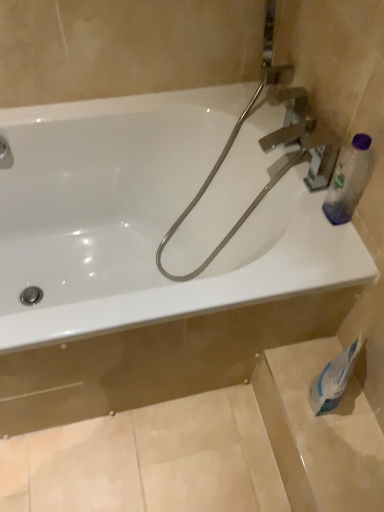
Question: From a real-world perspective, relative to transparent plastic bottle at upper right, is matte silver faucet at upper left vertically above or below?

Choices:
 (A) above
 (B) below

Answer: (B)

Question: Looking at their shapes, would you say matte silver faucet at upper left is wider or thinner than transparent plastic bottle at upper right?

Choices:
 (A) wide
 (B) thin

Answer: (A)

Question: Which of these objects is positioned farthest from the white glossy bathtub at upper center?

Choices:
 (A) transparent plastic bottle at upper right
 (B) matte silver faucet at upper left
 (C) white paper at lower right
 (D) metallic silver garden hose at upper right

Answer: (C)

Question: Considering the real-world distances, which object is closest to the metallic silver garden hose at upper right?

Choices:
 (A) transparent plastic bottle at upper right
 (B) white paper at lower right
 (C) white glossy bathtub at upper center
 (D) matte silver faucet at upper left

Answer: (C)